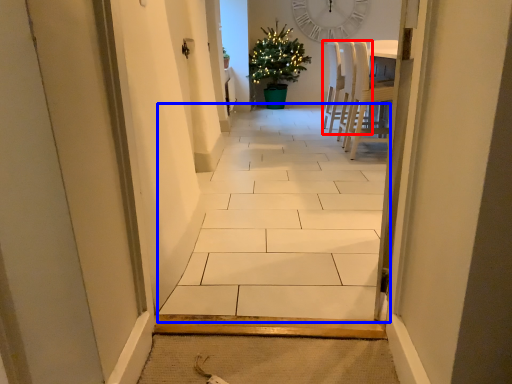
Question: Which of the following is the farthest to the observer, chair (highlighted by a red box) or alley (highlighted by a blue box)?

Choices:
 (A) chair
 (B) alley

Answer: (A)